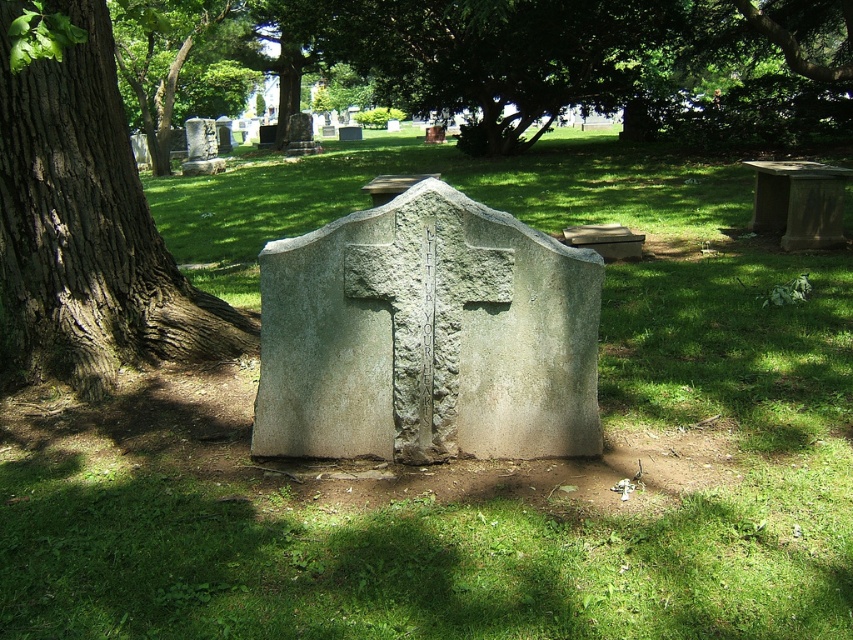
Question: Does gray stone cross at center have a smaller size compared to green leafy tree at upper center?

Choices:
 (A) no
 (B) yes

Answer: (A)

Question: Based on their relative distances, which object is nearer to the gray stone cross at center?

Choices:
 (A) green leafy tree at upper center
 (B) green leafy tree at upper left
 (C) dark brown bark tree at left

Answer: (C)

Question: From the image, what is the correct spatial relationship of gray stone cross at center in relation to green leafy tree at upper center?

Choices:
 (A) below
 (B) above

Answer: (A)

Question: Which of these objects is positioned farthest from the gray stone cross at center?

Choices:
 (A) dark brown bark tree at left
 (B) green leafy tree at upper center

Answer: (B)

Question: Can you confirm if gray stone cross at center is thinner than dark brown bark tree at left?

Choices:
 (A) no
 (B) yes

Answer: (A)

Question: Which point is closer to the camera?

Choices:
 (A) (207, 99)
 (B) (518, 150)

Answer: (B)